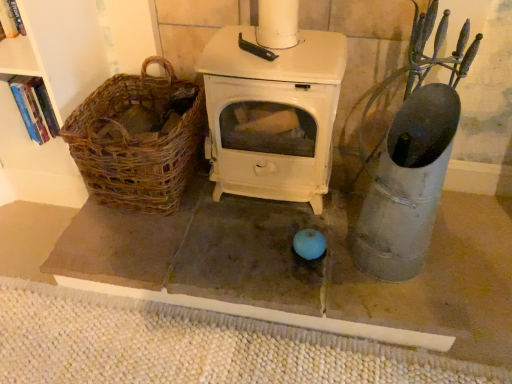
Question: Considering the positions of woven beige mat at lower center and woven brown basket at left in the image, is woven beige mat at lower center bigger or smaller than woven brown basket at left?

Choices:
 (A) small
 (B) big

Answer: (A)

Question: From a real-world perspective, is woven beige mat at lower center above or below woven brown basket at left?

Choices:
 (A) below
 (B) above

Answer: (A)

Question: Considering their positions, is woven beige mat at lower center located in front of or behind woven brown basket at left?

Choices:
 (A) behind
 (B) front

Answer: (B)

Question: Which is correct: woven brown basket at left is inside woven beige mat at lower center, or outside of it?

Choices:
 (A) outside
 (B) inside

Answer: (A)

Question: In terms of width, does woven brown basket at left look wider or thinner when compared to woven beige mat at lower center?

Choices:
 (A) wide
 (B) thin

Answer: (B)

Question: Would you say woven brown basket at left is to the left or to the right of woven beige mat at lower center in the picture?

Choices:
 (A) left
 (B) right

Answer: (A)

Question: Relative to woven beige mat at lower center, is woven brown basket at left in front or behind?

Choices:
 (A) behind
 (B) front

Answer: (A)